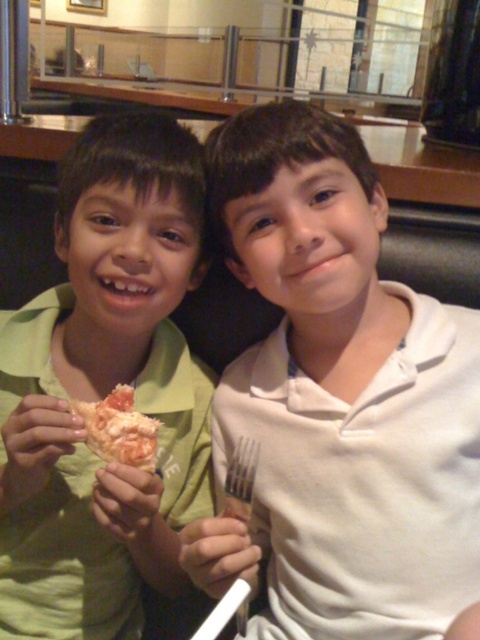
Does green matte shirt at left have a greater height compared to shiny orange pizza slice at center?

Indeed, green matte shirt at left has a greater height compared to shiny orange pizza slice at center.

Find the location of `green matte shirt at left`. green matte shirt at left is located at coordinates (x=105, y=388).

Does white matte fork at right come in front of shiny orange pizza slice at center?

Yes, it is in front of shiny orange pizza slice at center.

Looking at this image, who is more forward, [243,570] or [126,403]?

Point [243,570] is more forward.

Who is more forward, (417, 314) or (107, 419)?

Point (107, 419) is in front.

Locate an element on the screen. white matte fork at right is located at coordinates (338, 401).

Between white matte fork at right and green matte shirt at left, which one is positioned lower?

green matte shirt at left is below.

Who is positioned more to the left, white matte fork at right or green matte shirt at left?

green matte shirt at left is more to the left.

Who is more distant from viewer, (247,124) or (105,122)?

The point (105,122) is more distant.

At what (x,y) coordinates should I click in order to perform the action: click on white matte fork at right. Please return your answer as a coordinate pair (x, y). This screenshot has width=480, height=640. Looking at the image, I should click on (338, 401).